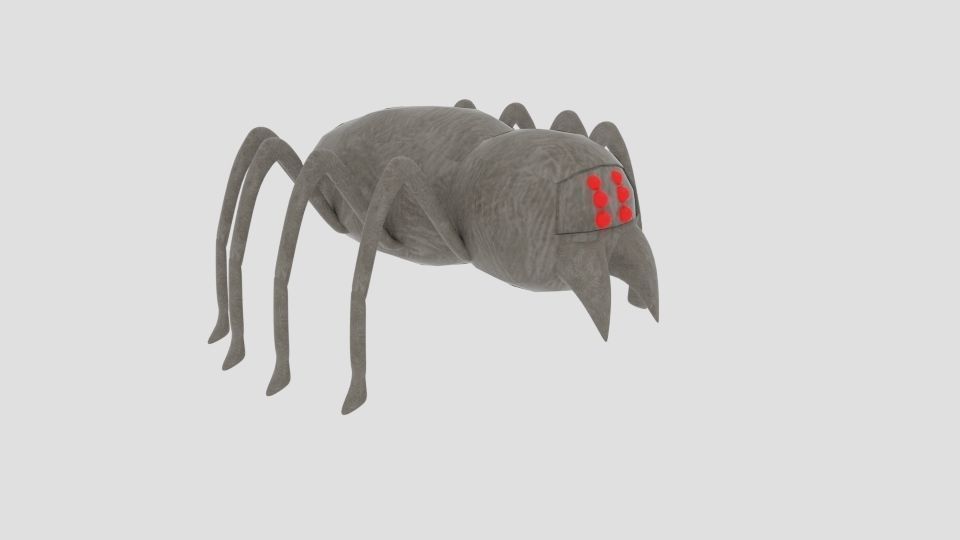
The width and height of the screenshot is (960, 540). I want to click on stuffed animal, so click(340, 135).